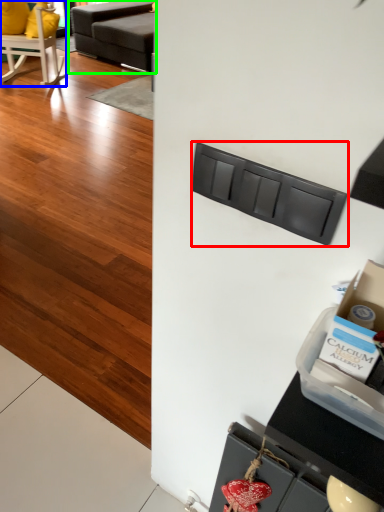
Question: Considering the real-world distances, which object is closest to drawer (highlighted by a red box)? chair (highlighted by a blue box) or studio couch (highlighted by a green box).

Choices:
 (A) chair
 (B) studio couch

Answer: (A)